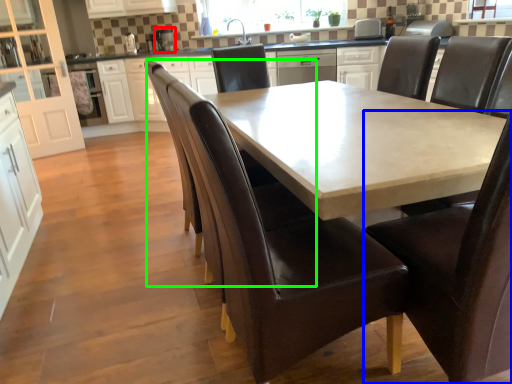
Question: Which is nearer to the appliance (highlighted by a red box)? chair (highlighted by a blue box) or armchair (highlighted by a green box).

Choices:
 (A) chair
 (B) armchair

Answer: (B)